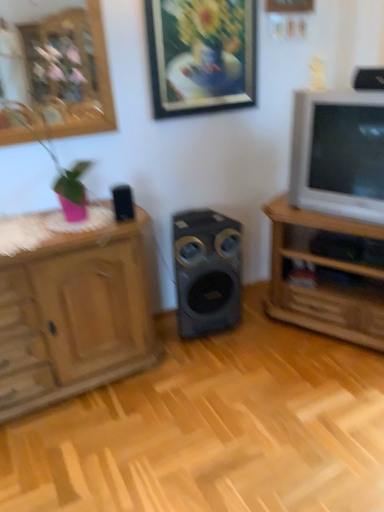
Locate an element on the screen. This screenshot has width=384, height=512. vacant space in front of matte black speaker at center, the 3th speaker positioned from the top is located at coordinates (218, 359).